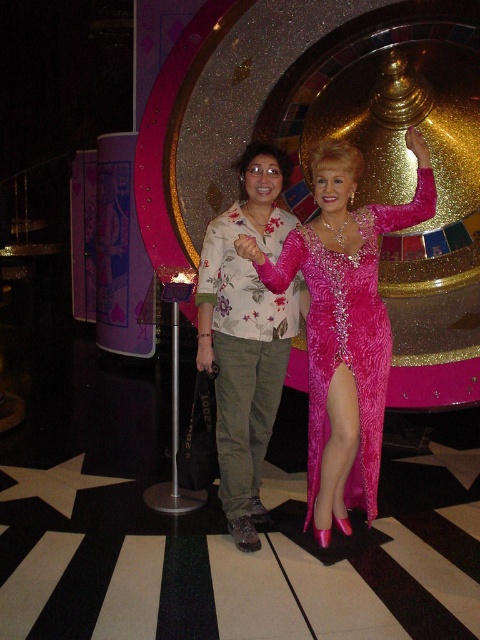
You are a GUI agent. You are given a task and a screenshot of the screen. Output one action in this format:
    pyautogui.click(x=<x>, y=<y>)
    Task: Click on the floral print shirt at center
    The height and width of the screenshot is (640, 480).
    Given the screenshot: What is the action you would take?
    pyautogui.click(x=247, y=332)

Is floral print shirt at center shorter than shiny pink fabric dress at center?

In fact, floral print shirt at center may be taller than shiny pink fabric dress at center.

Is point (228, 342) more distant than point (405, 220)?

Yes, it is behind point (405, 220).

Image resolution: width=480 pixels, height=640 pixels. Identify the location of floral print shirt at center. (247, 332).